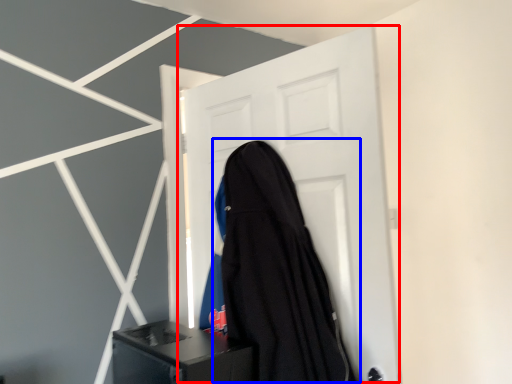
Question: Which of the following is the farthest to the observer, door (highlighted by a red box) or garment (highlighted by a blue box)?

Choices:
 (A) door
 (B) garment

Answer: (A)